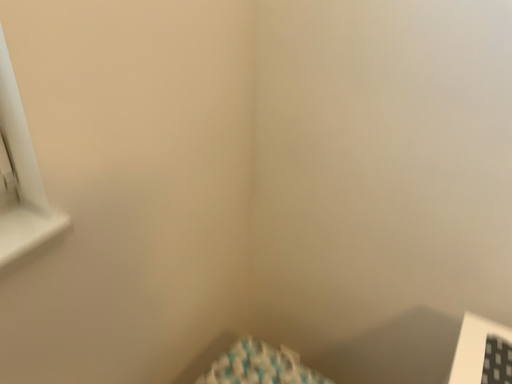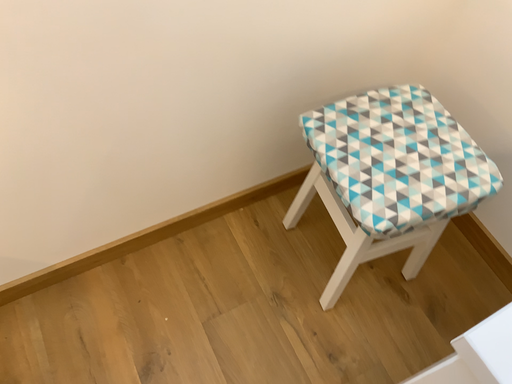
Question: Which way did the camera rotate in the video?

Choices:
 (A) rotated right
 (B) rotated left

Answer: (B)